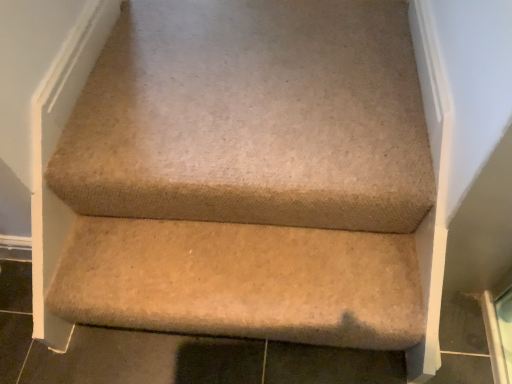
Question: Is point (204, 281) positioned closer to the camera than point (256, 48)?

Choices:
 (A) farther
 (B) closer

Answer: (B)

Question: In terms of size, does beige carpeted stair at lower center appear bigger or smaller than beige carpeted stairs at center?

Choices:
 (A) small
 (B) big

Answer: (B)

Question: Relative to beige carpeted stairs at center, is beige carpeted stair at lower center in front or behind?

Choices:
 (A) behind
 (B) front

Answer: (A)

Question: From the image's perspective, is beige carpeted stairs at center above or below beige carpeted stair at lower center?

Choices:
 (A) below
 (B) above

Answer: (B)

Question: Choose the correct answer: Is beige carpeted stairs at center inside beige carpeted stair at lower center or outside it?

Choices:
 (A) outside
 (B) inside

Answer: (A)

Question: Relative to beige carpeted stair at lower center, is beige carpeted stairs at center in front or behind?

Choices:
 (A) behind
 (B) front

Answer: (B)

Question: Is point (274, 203) positioned closer to the camera than point (339, 273)?

Choices:
 (A) farther
 (B) closer

Answer: (B)